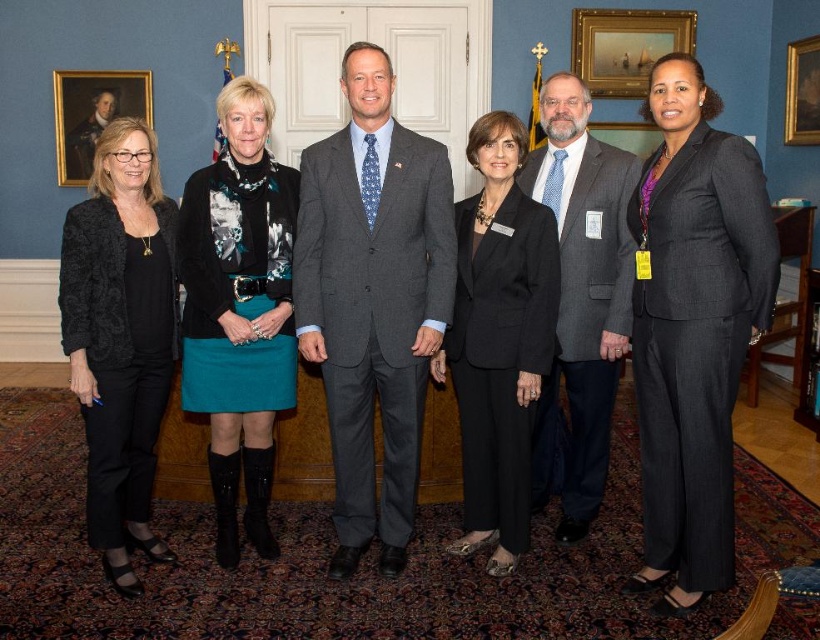
Question: Is charcoal gray suit at right in front of gray wool suit at center?

Choices:
 (A) yes
 (B) no

Answer: (A)

Question: Which object appears closest to the camera in this image?

Choices:
 (A) black wool suit at center
 (B) gray suit at center
 (C) teal skirt at center
 (D) black textured blazer at left

Answer: (D)

Question: Can you confirm if teal skirt at center is smaller than black wool suit at center?

Choices:
 (A) no
 (B) yes

Answer: (A)

Question: Which object is farther from the camera taking this photo?

Choices:
 (A) teal skirt at center
 (B) gray wool suit at center

Answer: (B)

Question: Does teal skirt at center appear under black textured blazer at left?

Choices:
 (A) yes
 (B) no

Answer: (B)

Question: Which point is closer to the camera?

Choices:
 (A) teal skirt at center
 (B) black textured blazer at left

Answer: (B)